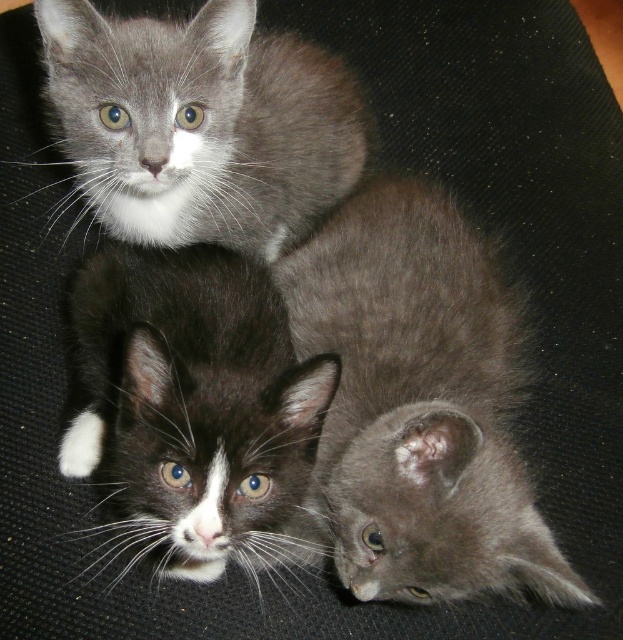
Question: Among these objects, which one is farthest from the camera?

Choices:
 (A) gray fluffy kitten at center
 (B) black and white fur cat at center

Answer: (B)

Question: Which point appears closest to the camera in this image?

Choices:
 (A) (173, 193)
 (B) (168, 387)

Answer: (B)

Question: Is black and white fur cat at center bigger than gray fluffy kitten at upper left?

Choices:
 (A) no
 (B) yes

Answer: (A)

Question: Is black and white fur cat at center above gray fluffy kitten at upper left?

Choices:
 (A) no
 (B) yes

Answer: (A)

Question: Where is gray fluffy kitten at center located in relation to gray fluffy kitten at upper left in the image?

Choices:
 (A) left
 (B) right

Answer: (B)

Question: Which object is closer to the camera taking this photo?

Choices:
 (A) black and white fur cat at center
 (B) gray fluffy kitten at center

Answer: (B)